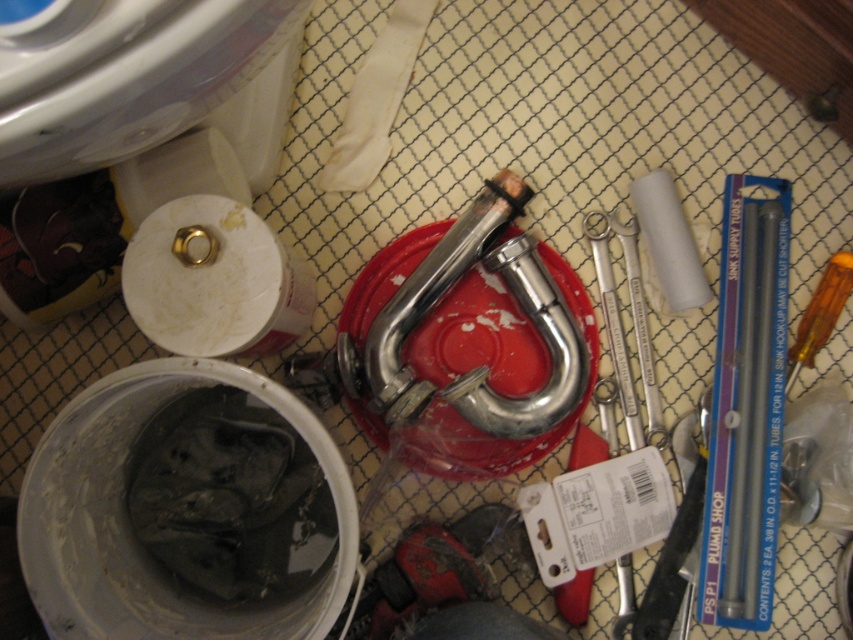
Question: Does orange plastic screwdriver at right have a smaller size compared to silver metallic wrench at center-right?

Choices:
 (A) no
 (B) yes

Answer: (B)

Question: Is silver metallic wrench at center closer to the viewer compared to silver metallic wrench at center-right?

Choices:
 (A) no
 (B) yes

Answer: (B)

Question: Which is nearer to the orange plastic screwdriver at right?

Choices:
 (A) silver metallic wrench at center
 (B) polished silver tube at right

Answer: (B)

Question: Among these points, which one is nearest to the camera?

Choices:
 (A) (747, 362)
 (B) (824, 317)
 (C) (660, 412)

Answer: (A)

Question: Can you confirm if polished silver tube at right is positioned above silver metallic wrench at center?

Choices:
 (A) no
 (B) yes

Answer: (A)

Question: Based on their relative distances, which object is farther from the silver metallic wrench at center?

Choices:
 (A) orange plastic screwdriver at right
 (B) polished silver tube at right

Answer: (A)